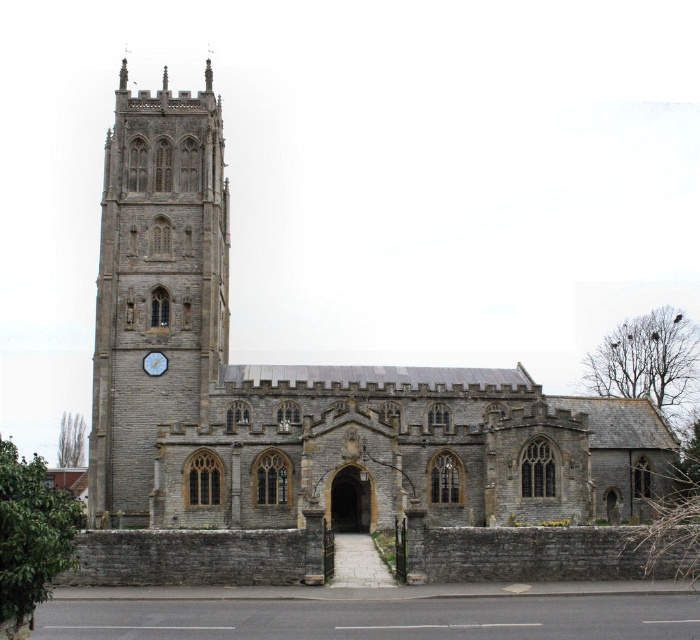
You are standing in front of the historic stone church and want to know which object is taller between the gray stone church at center and the blue painted wood clock at left. Can you determine this based on the scene?

The gray stone church at center has a greater height compared to the blue painted wood clock at left, so the gray stone church at center is taller.

You are standing in front of the historic stone church and need to locate a specific point marked as point (309, 410). Based on the description, where exactly on the church would this point be located?

The point (309, 410) is on the gray stone church at center, so it would be located on the main structure of the church, possibly on the walls or roof area where the light gray stone is prominently featured.